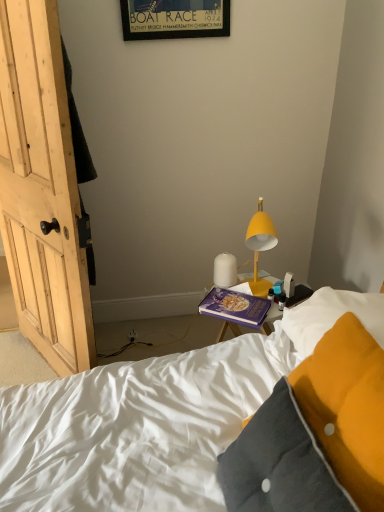
Question: Is purple matte book at center positioned in front of wooden framed poster at upper center?

Choices:
 (A) yes
 (B) no

Answer: (A)

Question: Is the position of purple matte book at center more distant than that of wooden framed poster at upper center?

Choices:
 (A) yes
 (B) no

Answer: (B)

Question: Is wooden framed poster at upper center at the back of purple matte book at center?

Choices:
 (A) yes
 (B) no

Answer: (B)

Question: From the image's perspective, is purple matte book at center located beneath wooden framed poster at upper center?

Choices:
 (A) yes
 (B) no

Answer: (A)

Question: Is wooden framed poster at upper center inside purple matte book at center?

Choices:
 (A) no
 (B) yes

Answer: (A)

Question: Based on their sizes in the image, would you say purple matte book at center is bigger or smaller than yellow matte lamp at upper right, arranged as the 2th lamp when viewed from the left?

Choices:
 (A) big
 (B) small

Answer: (B)

Question: Would you say purple matte book at center is inside or outside yellow matte lamp at upper right, arranged as the first lamp when viewed from the right?

Choices:
 (A) inside
 (B) outside

Answer: (B)

Question: In terms of height, does purple matte book at center look taller or shorter compared to yellow matte lamp at upper right, arranged as the first lamp when viewed from the right?

Choices:
 (A) tall
 (B) short

Answer: (B)

Question: From the image's perspective, is purple matte book at center above or below yellow matte lamp at upper right, arranged as the first lamp when viewed from the right?

Choices:
 (A) above
 (B) below

Answer: (B)

Question: Considering the positions of white matte lamp at center, which is counted as the 2th lamp, starting from the right, and velvet yellow pillow at lower right in the image, is white matte lamp at center, which is counted as the 2th lamp, starting from the right, wider or thinner than velvet yellow pillow at lower right?

Choices:
 (A) thin
 (B) wide

Answer: (A)

Question: In terms of height, does white matte lamp at center, which is counted as the 2th lamp, starting from the right, look taller or shorter compared to velvet yellow pillow at lower right?

Choices:
 (A) tall
 (B) short

Answer: (B)

Question: Would you say white matte lamp at center, marked as the 1th lamp in a left-to-right arrangement, is inside or outside velvet yellow pillow at lower right?

Choices:
 (A) outside
 (B) inside

Answer: (A)

Question: Is white matte lamp at center, which is counted as the 2th lamp, starting from the right, to the left or to the right of velvet yellow pillow at lower right in the image?

Choices:
 (A) right
 (B) left

Answer: (B)

Question: Relative to velvet yellow pillow at lower right, is wooden framed poster at upper center in front or behind?

Choices:
 (A) front
 (B) behind

Answer: (B)

Question: From the image's perspective, is wooden framed poster at upper center above or below velvet yellow pillow at lower right?

Choices:
 (A) below
 (B) above

Answer: (B)